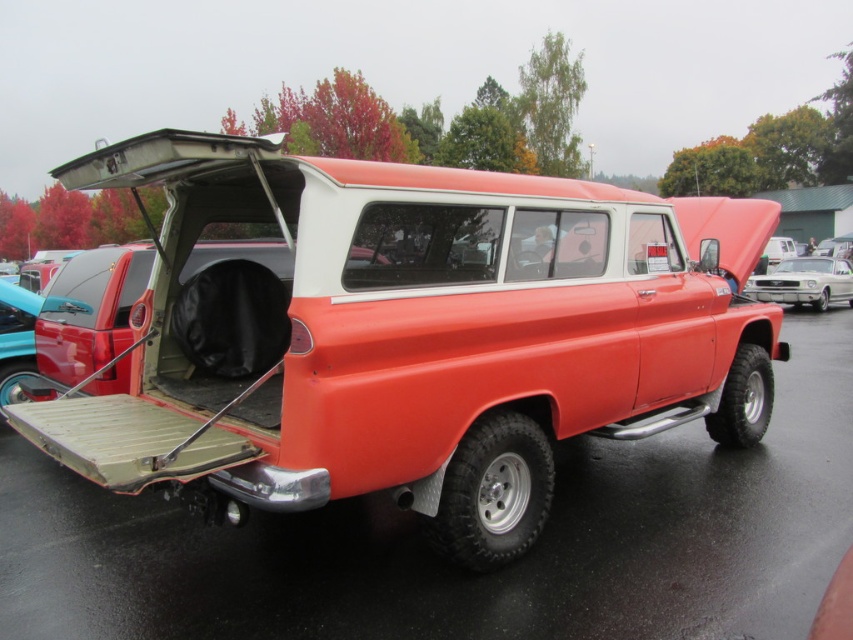
Which is behind, point (492, 387) or point (822, 292)?

The point (822, 292) is more distant.

Is matte orange truck at center to the right of metallic silver car at right from the viewer's perspective?

No, matte orange truck at center is not to the right of metallic silver car at right.

I want to click on matte orange truck at center, so click(x=413, y=336).